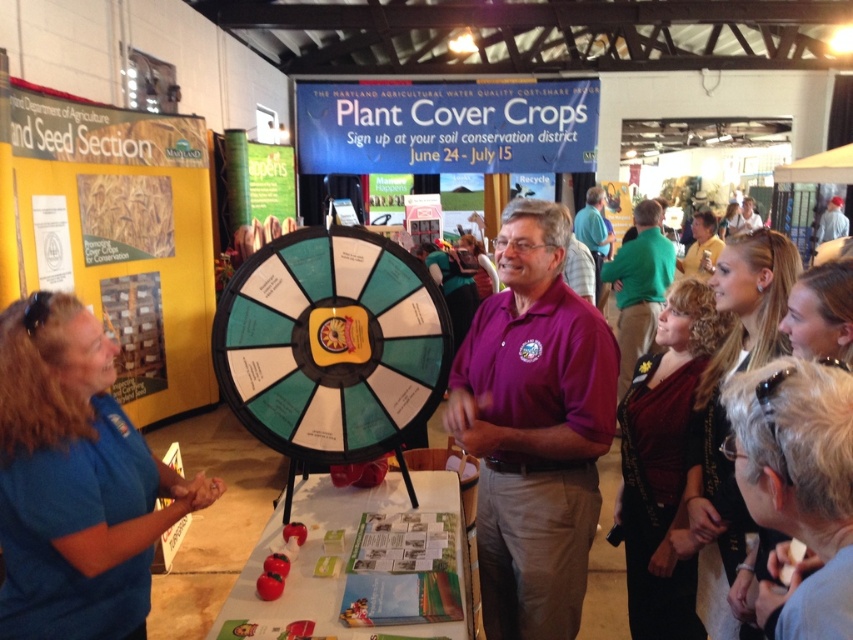
You are at an indoor fair and see the purple cotton shirt at center and the gray fur at lower right. Which object is positioned more to the right side of the scene?

The gray fur at lower right is positioned more to the right side of the scene.

You are at an indoor fair and want to compare the sizes of two items. You notice a purple cotton shirt at center and a gray fur at lower right. Which one has a greater width?

The purple cotton shirt at center has a greater width than the gray fur at lower right.